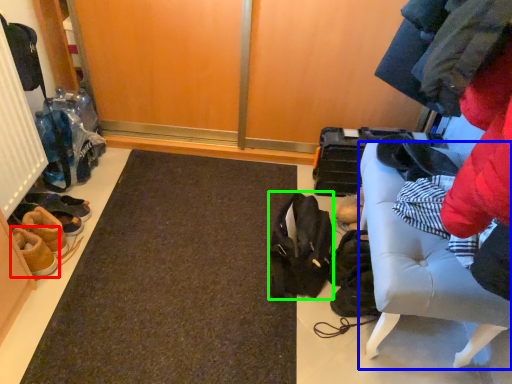
Question: Which object is positioned farthest from footwear (highlighted by a red box)? Select from furniture (highlighted by a blue box) and shoulder bag (highlighted by a green box).

Choices:
 (A) furniture
 (B) shoulder bag

Answer: (A)